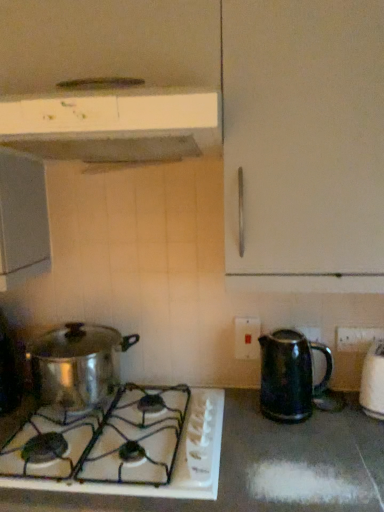
Question: Is white plastic electric outlet at center, which is counted as the first electric outlet, starting from the back, closer to camera compared to black plastic electric outlet at lower right, which ranks as the 1th electric outlet in front-to-back order?

Choices:
 (A) no
 (B) yes

Answer: (A)

Question: Is white plastic electric outlet at center, the 2th electric outlet when ordered from right to left, aimed at black plastic electric outlet at lower right, which is counted as the 2th electric outlet, starting from the left?

Choices:
 (A) yes
 (B) no

Answer: (B)

Question: Considering the relative sizes of white plastic electric outlet at center, the second electric outlet positioned from the front, and black plastic electric outlet at lower right, which appears as the 2th electric outlet when viewed from the back, in the image provided, is white plastic electric outlet at center, the second electric outlet positioned from the front, smaller than black plastic electric outlet at lower right, which appears as the 2th electric outlet when viewed from the back,?

Choices:
 (A) no
 (B) yes

Answer: (A)

Question: Does white plastic electric outlet at center, the second electric outlet positioned from the front, have a larger size compared to black plastic electric outlet at lower right, which is counted as the 2th electric outlet, starting from the left?

Choices:
 (A) yes
 (B) no

Answer: (A)

Question: Considering the relative sizes of white plastic electric outlet at center, the 2th electric outlet when ordered from right to left, and black plastic electric outlet at lower right, which ranks as the 1th electric outlet in front-to-back order, in the image provided, is white plastic electric outlet at center, the 2th electric outlet when ordered from right to left, wider than black plastic electric outlet at lower right, which ranks as the 1th electric outlet in front-to-back order,?

Choices:
 (A) no
 (B) yes

Answer: (B)

Question: Is white plastic electric outlet at center, the first electric outlet viewed from the left, not within black plastic electric outlet at lower right, which is counted as the 2th electric outlet, starting from the left?

Choices:
 (A) yes
 (B) no

Answer: (A)

Question: Does shiny metallic kettle at right, the first kitchen appliance ordered from the bottom, have a larger size compared to black plastic electric outlet at lower right, which appears as the 2th electric outlet when viewed from the back?

Choices:
 (A) yes
 (B) no

Answer: (A)

Question: From the image's perspective, would you say shiny metallic kettle at right, the first kitchen appliance ordered from the bottom, is shown under black plastic electric outlet at lower right, which appears as the 2th electric outlet when viewed from the back?

Choices:
 (A) yes
 (B) no

Answer: (A)

Question: Can we say shiny metallic kettle at right, marked as the 3th kitchen appliance in a top-to-bottom arrangement, lies outside black plastic electric outlet at lower right, which appears as the 2th electric outlet when viewed from the back?

Choices:
 (A) yes
 (B) no

Answer: (A)

Question: Is shiny metallic kettle at right, the first kitchen appliance ordered from the bottom, smaller than black plastic electric outlet at lower right, which ranks as the 1th electric outlet in front-to-back order?

Choices:
 (A) yes
 (B) no

Answer: (B)

Question: Is black plastic electric outlet at lower right, which appears as the 2th electric outlet when viewed from the back, at the back of shiny metallic kettle at right, marked as the 3th kitchen appliance in a top-to-bottom arrangement?

Choices:
 (A) yes
 (B) no

Answer: (B)

Question: Considering the relative sizes of shiny metallic kettle at right, marked as the 3th kitchen appliance in a top-to-bottom arrangement, and black plastic electric outlet at lower right, which ranks as the 1th electric outlet in front-to-back order, in the image provided, is shiny metallic kettle at right, marked as the 3th kitchen appliance in a top-to-bottom arrangement, taller than black plastic electric outlet at lower right, which ranks as the 1th electric outlet in front-to-back order,?

Choices:
 (A) yes
 (B) no

Answer: (A)

Question: Does shiny metallic pot at lower left, which is counted as the second kitchen appliance, starting from the top, appear on the left side of black plastic electric outlet at lower right, which appears as the 2th electric outlet when viewed from the back?

Choices:
 (A) no
 (B) yes

Answer: (B)